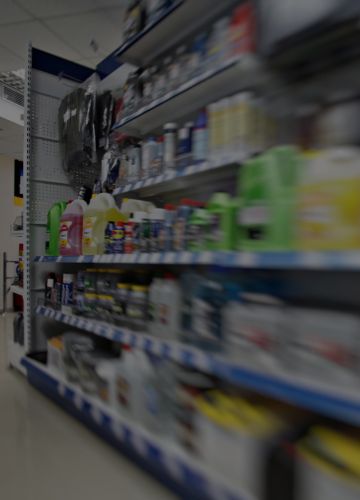
At what (x,y) coordinates should I click in order to perform the action: click on vent. Please return your answer as a coordinate pair (x, y). Looking at the image, I should click on (12, 98).